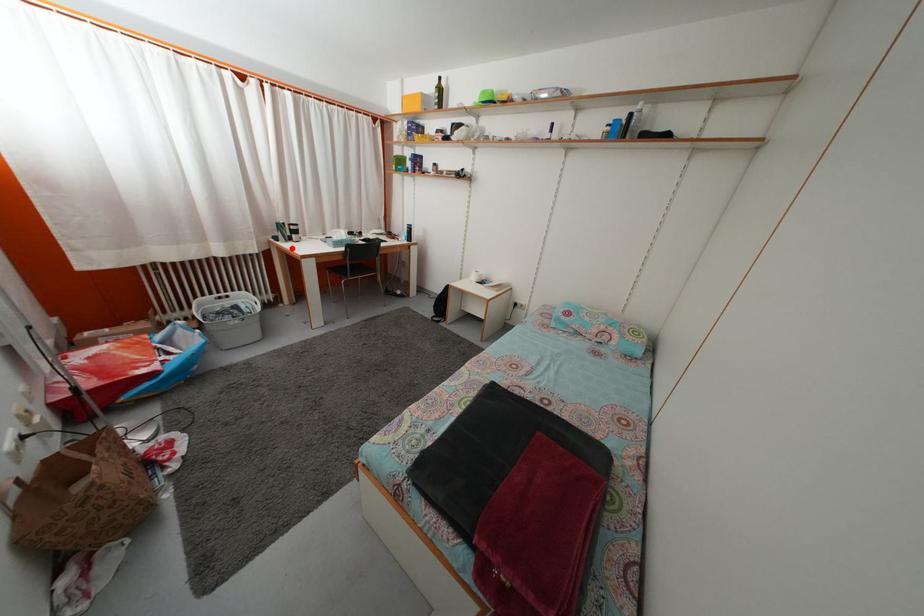
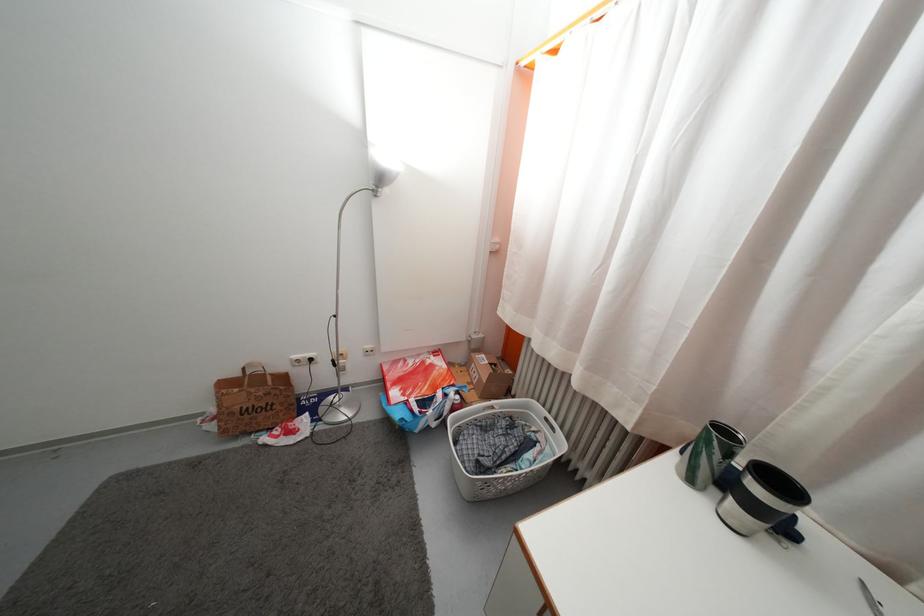
Question: I am providing you with two images of the same scene from different viewpoints. A red point is marked on the first image. Can you still see the location of the red point in image 2?

Choices:
 (A) Yes
 (B) No

Answer: (A)